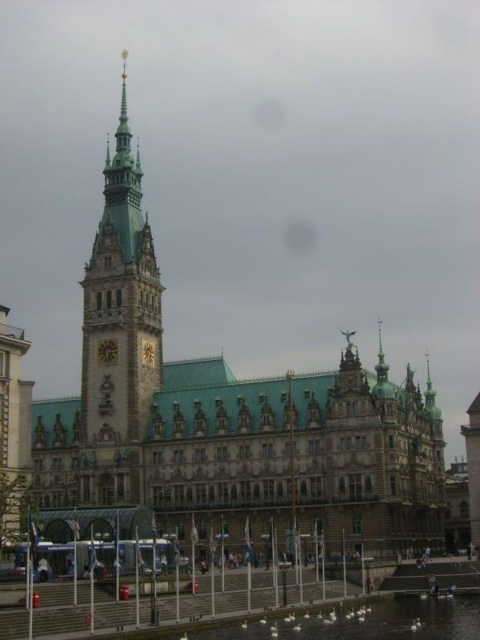
Does green metallic building at center have a lesser height compared to stone clock tower at center-left?

No.

This screenshot has width=480, height=640. What do you see at coordinates (228, 419) in the screenshot? I see `green metallic building at center` at bounding box center [228, 419].

Where is `green metallic building at center`? The height and width of the screenshot is (640, 480). green metallic building at center is located at coordinates (228, 419).